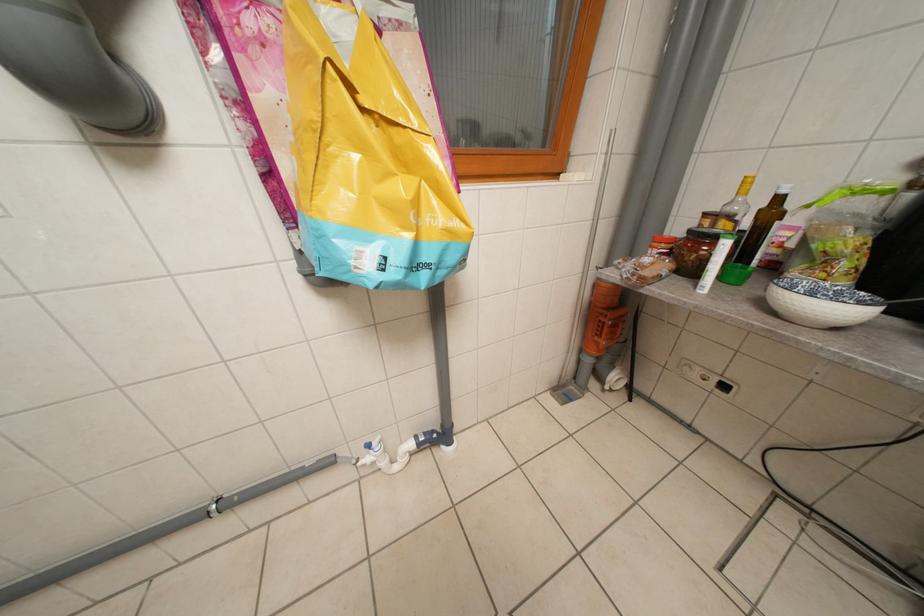
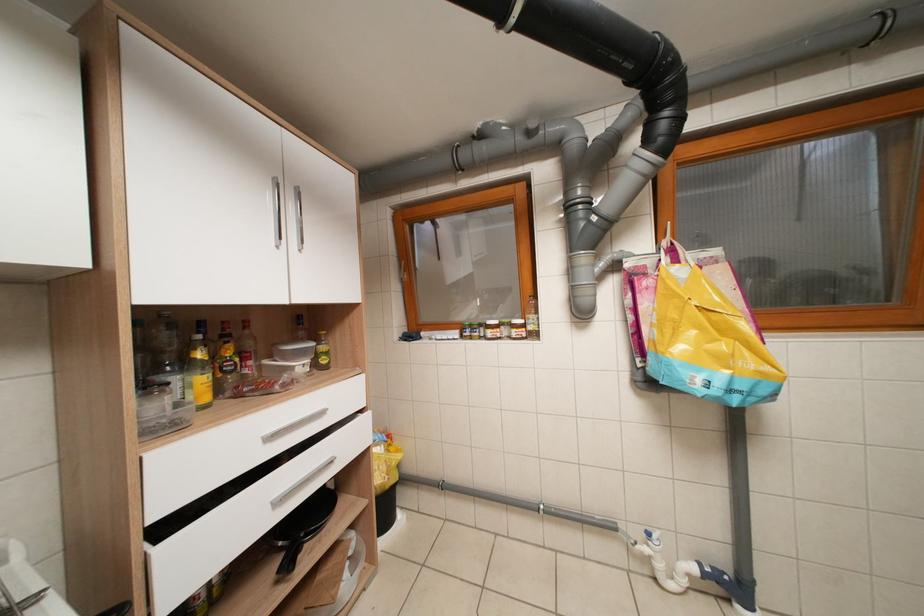
First-person continuous shooting, in which direction is the camera rotating?

The rotation direction of the camera is left-up.